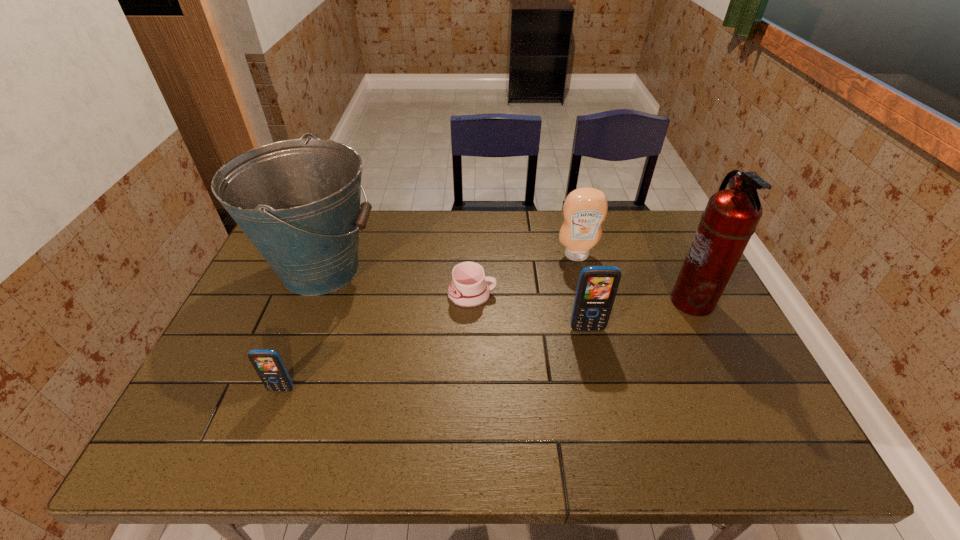
The image size is (960, 540). Find the location of `object positioned at the left edge`. object positioned at the left edge is located at coordinates (298, 201).

Where is `object present at the right edge`? object present at the right edge is located at coordinates (730, 218).

Where is `object that is at the far left corner`? object that is at the far left corner is located at coordinates (298, 201).

Locate an element on the screen. The image size is (960, 540). vacant space at the far edge of the desktop is located at coordinates [x=425, y=215].

I want to click on free spot at the near edge of the desktop, so click(x=468, y=396).

In the image, there is a desktop. Where is `free region at the left edge`? The width and height of the screenshot is (960, 540). free region at the left edge is located at coordinates (254, 292).

Identify the location of blank space at the far right corner. (636, 237).

Where is `vacant space that is in between the second shortest object and the condiment`? This screenshot has width=960, height=540. vacant space that is in between the second shortest object and the condiment is located at coordinates (429, 322).

Locate an element on the screen. empty space that is in between the tallest object and the nearer cellular telephone is located at coordinates (487, 346).

Locate an element on the screen. free area in between the shortest object and the right cellular telephone is located at coordinates (530, 312).